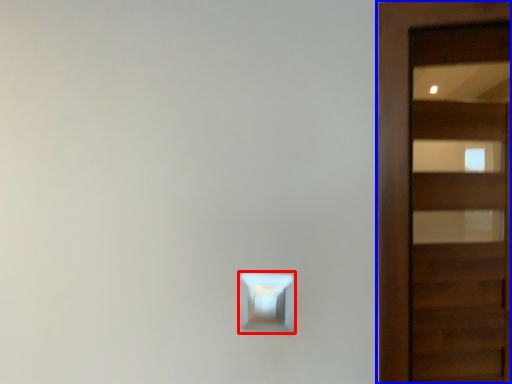
Question: Which object is closer to the camera taking this photo, light switch (highlighted by a red box) or door (highlighted by a blue box)?

Choices:
 (A) light switch
 (B) door

Answer: (A)